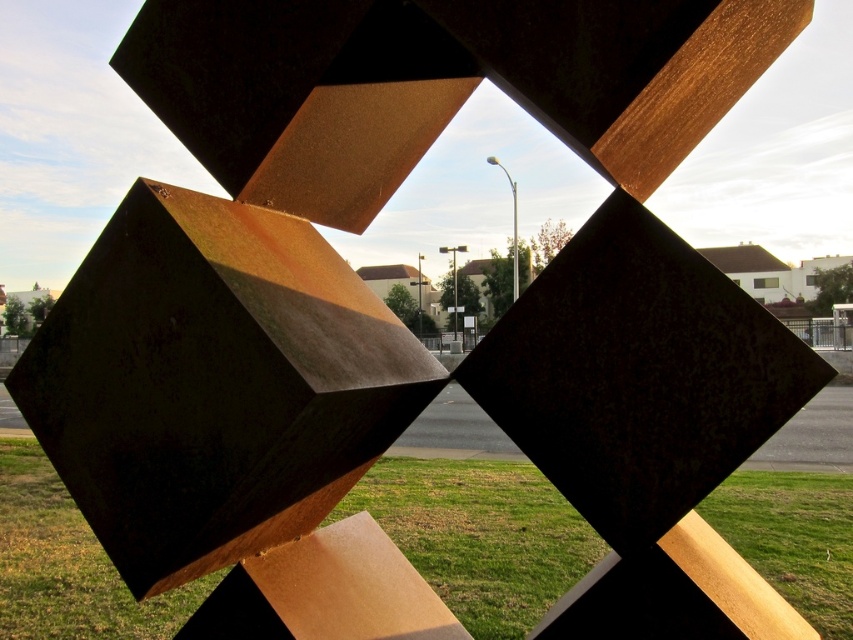
You are standing in front of the geometric sculpture and want to touch the two points mentioned. Which point, point (502, 512) or point (462, 348), is closer to you?

Point (502, 512) is closer to the viewer than point (462, 348), so you can reach it first.

You are an artist planning to paint the sculpture. You need to decide whether to include the green grass at lower center and the rusty metal fence at center in your painting. Since you want to emphasize the foreground elements, which object should you make more prominent in your artwork?

The green grass at lower center should be made more prominent because it is larger in size compared to the rusty metal fence at center, making it a stronger foreground element.

Looking at this image, you are standing in front of the sculpture and see the rusty metal fence at center and the rusty metal fence at lower left. Which one is more to the left?

The rusty metal fence at lower left is more to the left.